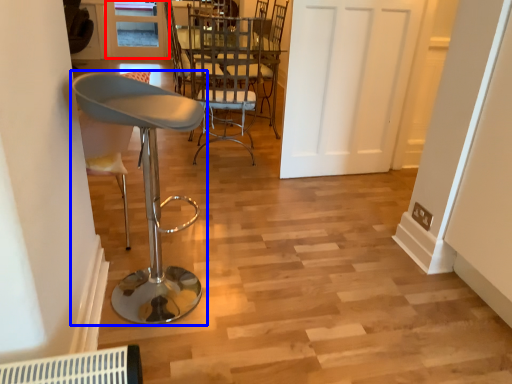
Question: Which point is further to the camera, window (highlighted by a red box) or chair (highlighted by a blue box)?

Choices:
 (A) window
 (B) chair

Answer: (A)